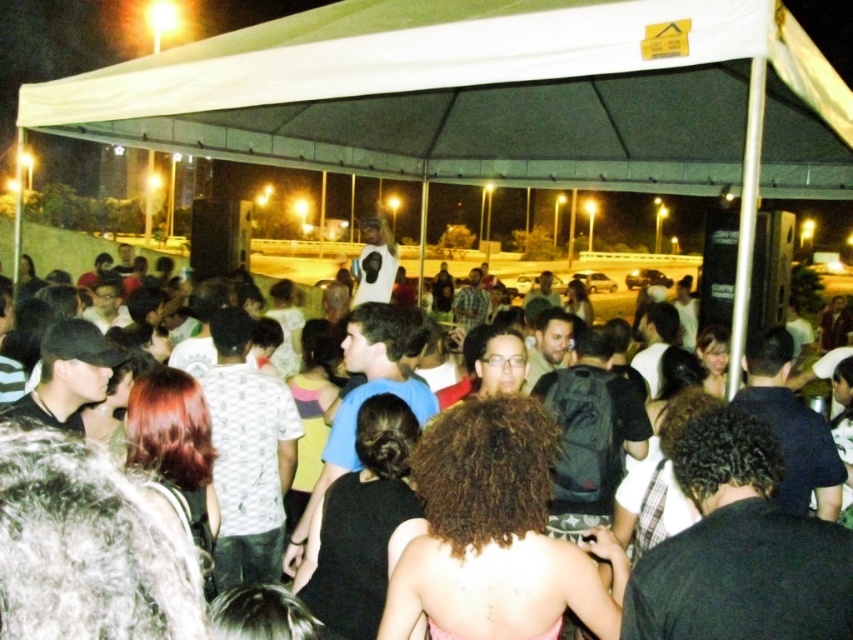
Question: Can you confirm if white fabric canopy at upper center is positioned above black fabric crowd at center?

Choices:
 (A) yes
 (B) no

Answer: (A)

Question: Can you confirm if white fabric canopy at upper center is thinner than black fabric crowd at center?

Choices:
 (A) yes
 (B) no

Answer: (B)

Question: Among these objects, which one is nearest to the camera?

Choices:
 (A) white fabric canopy at upper center
 (B) black fabric crowd at center

Answer: (B)

Question: Which of the following is the closest to the observer?

Choices:
 (A) (305, 148)
 (B) (173, 608)

Answer: (B)

Question: From the image, what is the correct spatial relationship of white fabric canopy at upper center in relation to black fabric crowd at center?

Choices:
 (A) left
 (B) right

Answer: (B)

Question: Which point appears farthest from the camera in this image?

Choices:
 (A) (126, 618)
 (B) (520, 84)

Answer: (B)